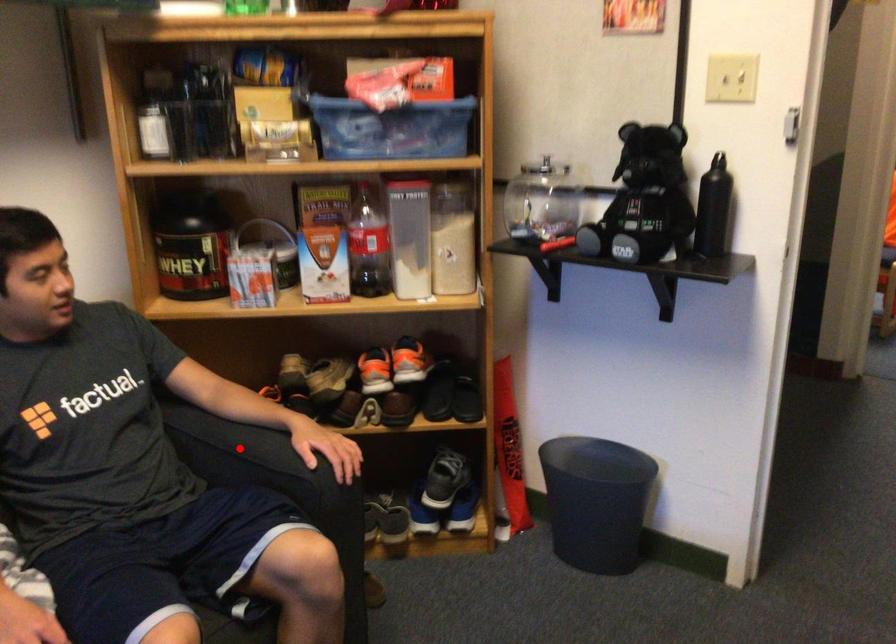
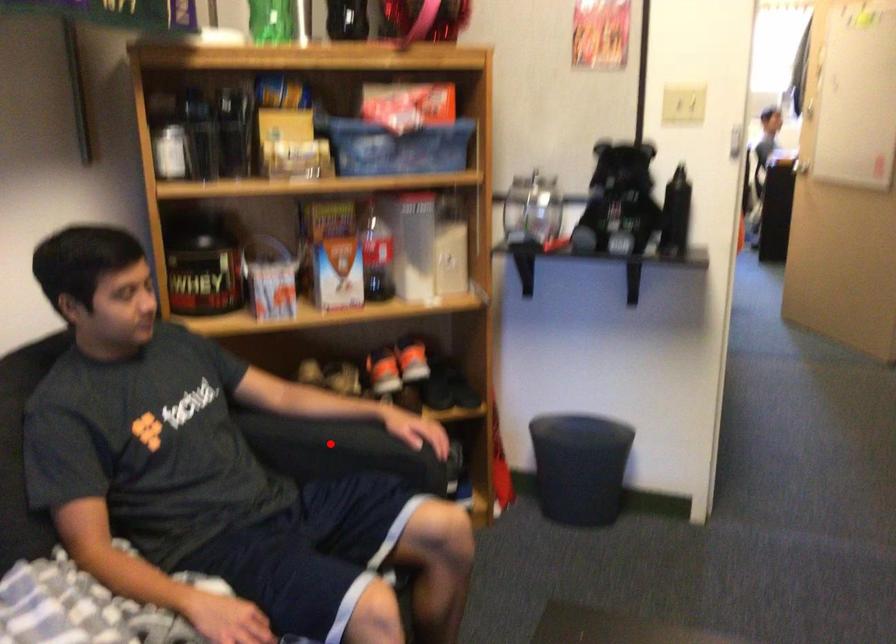
I am providing you with two images of the same scene from different viewpoints. A red point is marked on the first image and another point is marked on the second image. Do the highlighted points in image1 and image2 indicate the same real-world spot?

Yes